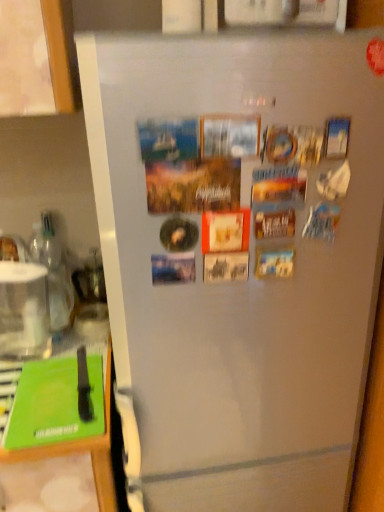
Question: Considering the relative sizes of green plastic cutting board at lower left and clear glass water at left in the image provided, is green plastic cutting board at lower left smaller than clear glass water at left?

Choices:
 (A) yes
 (B) no

Answer: (B)

Question: Does green plastic cutting board at lower left touch clear glass water at left?

Choices:
 (A) no
 (B) yes

Answer: (A)

Question: Does green plastic cutting board at lower left have a greater height compared to clear glass water at left?

Choices:
 (A) no
 (B) yes

Answer: (B)

Question: Is green plastic cutting board at lower left wider than clear glass water at left?

Choices:
 (A) no
 (B) yes

Answer: (B)

Question: Is green plastic cutting board at lower left positioned behind clear glass water at left?

Choices:
 (A) yes
 (B) no

Answer: (B)

Question: In the image, is clear glass water at left positioned in front of or behind green plastic cutting board at lower left?

Choices:
 (A) behind
 (B) front

Answer: (A)

Question: From the image's perspective, is clear glass water at left above or below green plastic cutting board at lower left?

Choices:
 (A) below
 (B) above

Answer: (B)

Question: Is clear glass water at left wider or thinner than green plastic cutting board at lower left?

Choices:
 (A) wide
 (B) thin

Answer: (B)

Question: Considering the positions of clear glass water at left and green plastic cutting board at lower left in the image, is clear glass water at left taller or shorter than green plastic cutting board at lower left?

Choices:
 (A) tall
 (B) short

Answer: (B)

Question: Would you say green plastic cutting board at lower left is to the left or to the right of green matte magazine at lower left in the picture?

Choices:
 (A) right
 (B) left

Answer: (B)

Question: Based on their sizes in the image, would you say green plastic cutting board at lower left is bigger or smaller than green matte magazine at lower left?

Choices:
 (A) big
 (B) small

Answer: (A)

Question: From a real-world perspective, is green plastic cutting board at lower left positioned above or below green matte magazine at lower left?

Choices:
 (A) above
 (B) below

Answer: (B)

Question: Considering their positions, is green plastic cutting board at lower left located in front of or behind green matte magazine at lower left?

Choices:
 (A) front
 (B) behind

Answer: (A)

Question: Based on their sizes in the image, would you say clear glass water at left is bigger or smaller than green matte magazine at lower left?

Choices:
 (A) big
 (B) small

Answer: (A)

Question: Relative to green matte magazine at lower left, is clear glass water at left in front or behind?

Choices:
 (A) front
 (B) behind

Answer: (B)